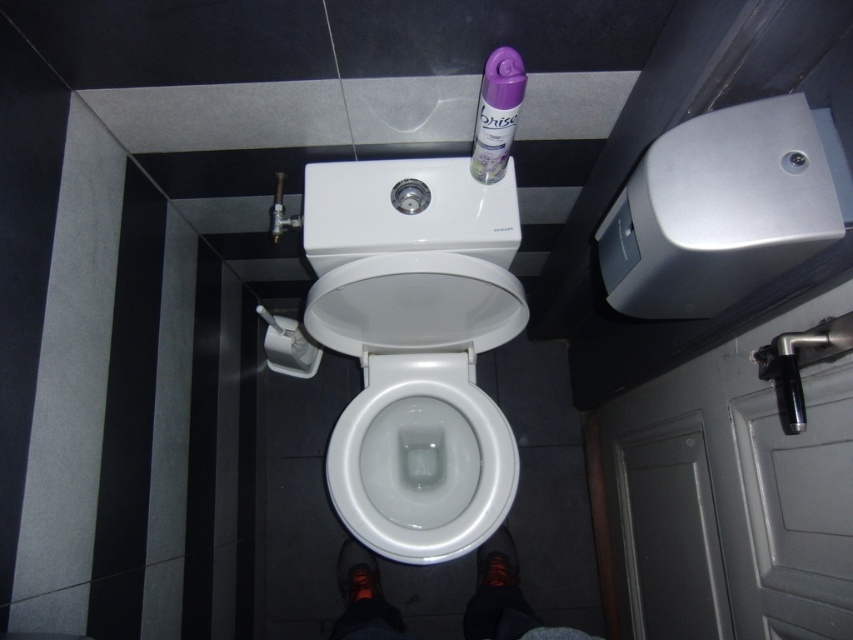
Is white glossy toilet bowl at center closer to the viewer compared to purple plastic spray can at upper center?

No, white glossy toilet bowl at center is further to the viewer.

Is point (460, 502) positioned in front of point (509, 136)?

No, (460, 502) is further to viewer.

Where is `white glossy toilet bowl at center`? white glossy toilet bowl at center is located at coordinates (421, 460).

Identify the location of white glossy toilet bowl at center. (421, 460).